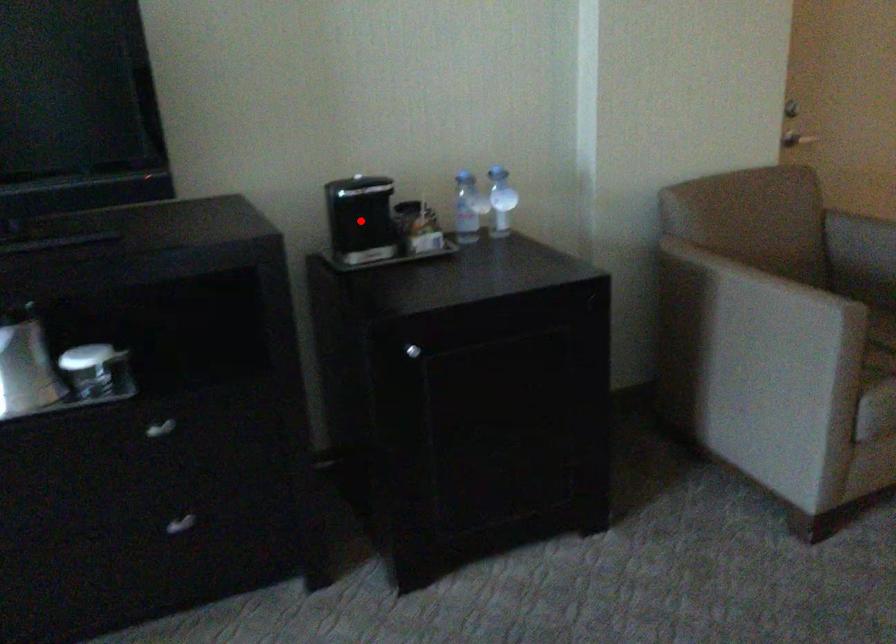
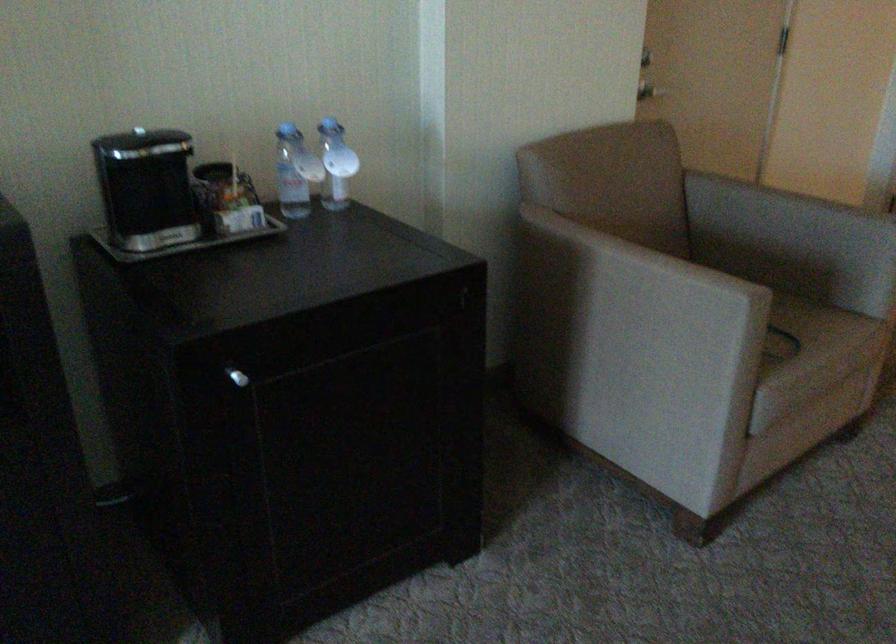
Locate, in the second image, the point that corresponds to the highlighted location in the first image.

(149, 194)